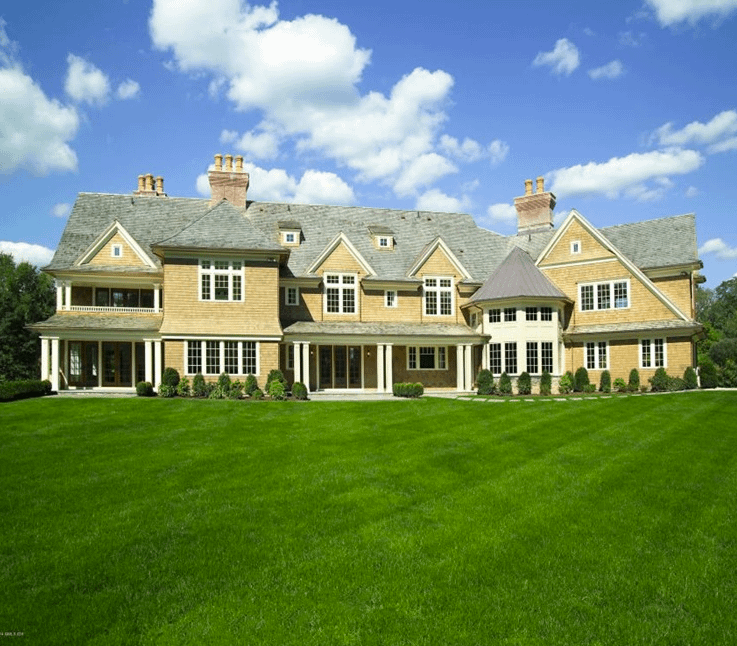
The width and height of the screenshot is (737, 646). In order to click on window in this screenshot , I will do `click(225, 280)`, `click(349, 307)`, `click(444, 304)`, `click(617, 289)`.